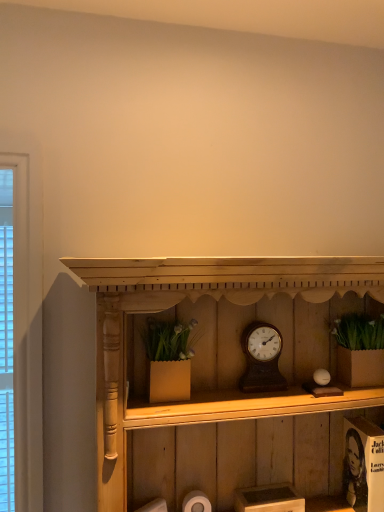
Question: Is wooden clock at center touching wooden shelf at center?

Choices:
 (A) yes
 (B) no

Answer: (B)

Question: From a real-world perspective, is wooden clock at center physically below wooden shelf at center?

Choices:
 (A) no
 (B) yes

Answer: (A)

Question: Is wooden clock at center shorter than wooden shelf at center?

Choices:
 (A) no
 (B) yes

Answer: (B)

Question: Is wooden clock at center facing away from wooden shelf at center?

Choices:
 (A) no
 (B) yes

Answer: (B)

Question: Is wooden clock at center not near wooden shelf at center?

Choices:
 (A) yes
 (B) no

Answer: (B)

Question: Is wooden clock at center at the right side of wooden shelf at center?

Choices:
 (A) no
 (B) yes

Answer: (B)

Question: Is wooden clock at center shorter than white matte toilet paper at lower center?

Choices:
 (A) yes
 (B) no

Answer: (B)

Question: From a real-world perspective, is wooden clock at center located higher than white matte toilet paper at lower center?

Choices:
 (A) yes
 (B) no

Answer: (A)

Question: Is white matte toilet paper at lower center at the back of wooden clock at center?

Choices:
 (A) no
 (B) yes

Answer: (A)

Question: From the image's perspective, is wooden clock at center under white matte toilet paper at lower center?

Choices:
 (A) no
 (B) yes

Answer: (A)

Question: Is wooden clock at center bigger than white matte toilet paper at lower center?

Choices:
 (A) yes
 (B) no

Answer: (A)

Question: Considering the relative sizes of wooden clock at center and white matte toilet paper at lower center in the image provided, is wooden clock at center taller than white matte toilet paper at lower center?

Choices:
 (A) yes
 (B) no

Answer: (A)

Question: Considering the relative sizes of wooden shelf at center and wooden clock at center in the image provided, is wooden shelf at center shorter than wooden clock at center?

Choices:
 (A) no
 (B) yes

Answer: (A)